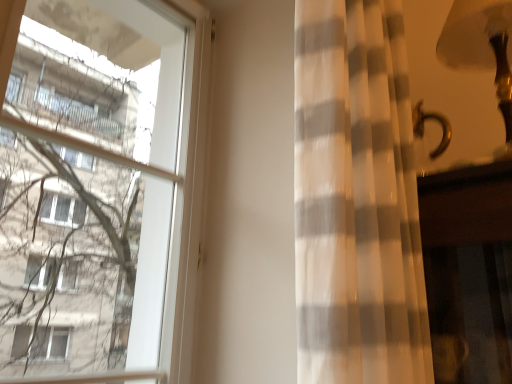
Question: Considering the relative sizes of gold metallic table lamp at upper right and transparent glass window at left in the image provided, is gold metallic table lamp at upper right thinner than transparent glass window at left?

Choices:
 (A) no
 (B) yes

Answer: (A)

Question: Is gold metallic table lamp at upper right not within transparent glass window at left?

Choices:
 (A) yes
 (B) no

Answer: (A)

Question: Considering the relative positions of gold metallic table lamp at upper right and transparent glass window at left in the image provided, is gold metallic table lamp at upper right to the left of transparent glass window at left from the viewer's perspective?

Choices:
 (A) no
 (B) yes

Answer: (A)

Question: Does gold metallic table lamp at upper right have a larger size compared to transparent glass window at left?

Choices:
 (A) yes
 (B) no

Answer: (B)

Question: From the image's perspective, is gold metallic table lamp at upper right under transparent glass window at left?

Choices:
 (A) no
 (B) yes

Answer: (A)

Question: Is gold metallic table lamp at upper right oriented towards transparent glass window at left?

Choices:
 (A) no
 (B) yes

Answer: (A)

Question: Considering the relative sizes of white sheer curtain at right and transparent glass window at left in the image provided, is white sheer curtain at right bigger than transparent glass window at left?

Choices:
 (A) yes
 (B) no

Answer: (A)

Question: Does white sheer curtain at right touch transparent glass window at left?

Choices:
 (A) yes
 (B) no

Answer: (B)

Question: Can you confirm if white sheer curtain at right is taller than transparent glass window at left?

Choices:
 (A) yes
 (B) no

Answer: (A)

Question: Can you confirm if white sheer curtain at right is positioned to the right of transparent glass window at left?

Choices:
 (A) yes
 (B) no

Answer: (A)

Question: Does white sheer curtain at right appear on the left side of transparent glass window at left?

Choices:
 (A) no
 (B) yes

Answer: (A)

Question: Considering the relative positions of white sheer curtain at right and transparent glass window at left in the image provided, is white sheer curtain at right behind transparent glass window at left?

Choices:
 (A) no
 (B) yes

Answer: (A)

Question: Are gold metallic table lamp at upper right and white sheer curtain at right far apart?

Choices:
 (A) yes
 (B) no

Answer: (B)